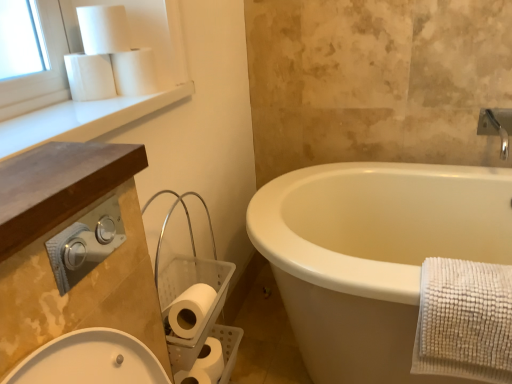
Locate an element on the screen. This screenshot has height=384, width=512. vacant point above brown wood countertop at upper left (from a real-world perspective) is located at coordinates (49, 168).